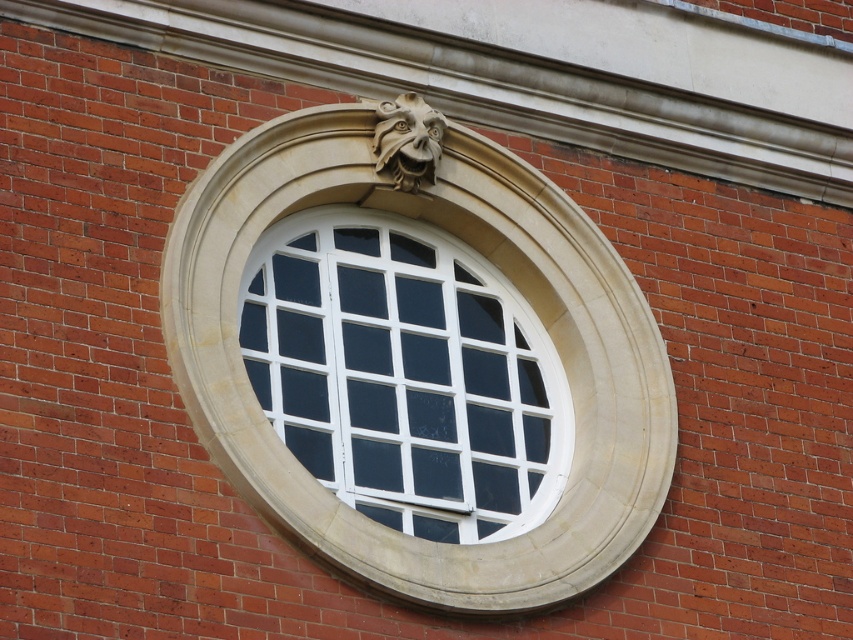
From the picture: Does white stone window frame at center have a lesser height compared to white glass window at center?

In fact, white stone window frame at center may be taller than white glass window at center.

Who is taller, white stone window frame at center or white glass window at center?

white stone window frame at center

I want to click on white stone window frame at center, so click(x=419, y=364).

At what (x,y) coordinates should I click in order to perform the action: click on white glass window at center. Please return your answer as a coordinate pair (x, y). Looking at the image, I should click on (405, 374).

Does white glass window at center appear on the left side of polished stone lion head at upper center?

Incorrect, white glass window at center is not on the left side of polished stone lion head at upper center.

Which is in front, point (366, 296) or point (422, 131)?

Positioned in front is point (366, 296).

Where is `white glass window at center`? The width and height of the screenshot is (853, 640). white glass window at center is located at coordinates (405, 374).

Is the position of white stone window frame at center less distant than that of polished stone lion head at upper center?

Yes, it is in front of polished stone lion head at upper center.

Between white stone window frame at center and polished stone lion head at upper center, which one has less height?

Standing shorter between the two is polished stone lion head at upper center.

I want to click on white stone window frame at center, so click(x=419, y=364).